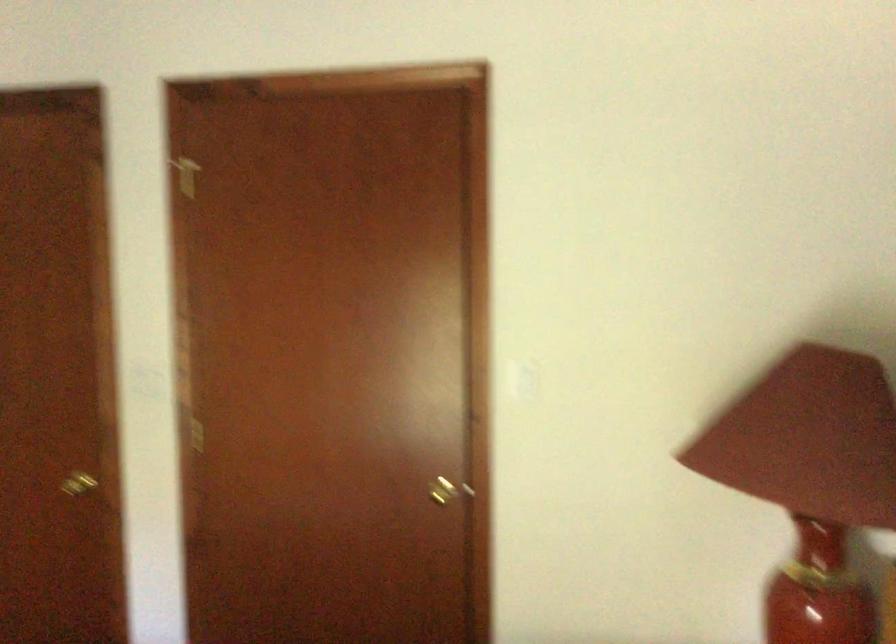
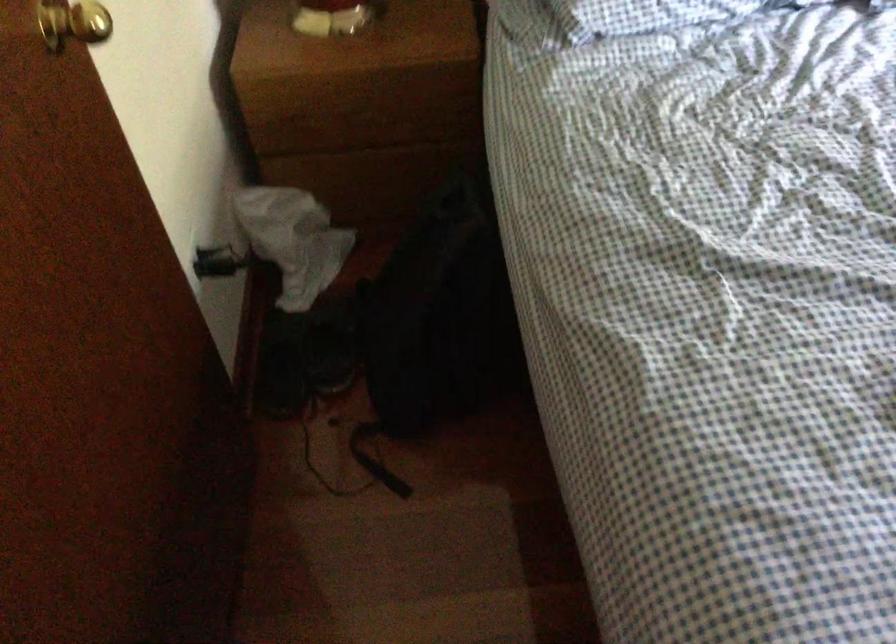
The point at [437,482] is marked in the first image. Where is the corresponding point in the second image?

(73, 23)